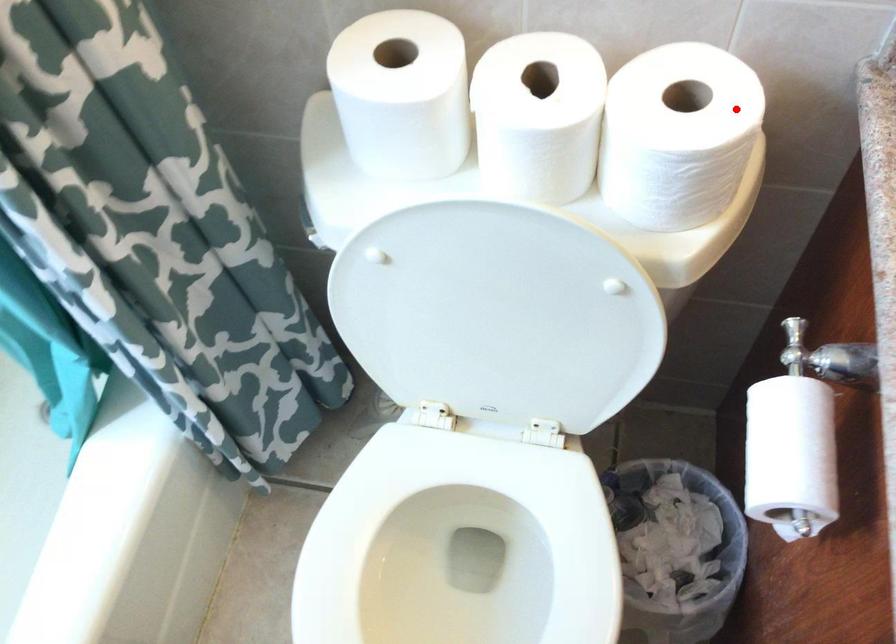
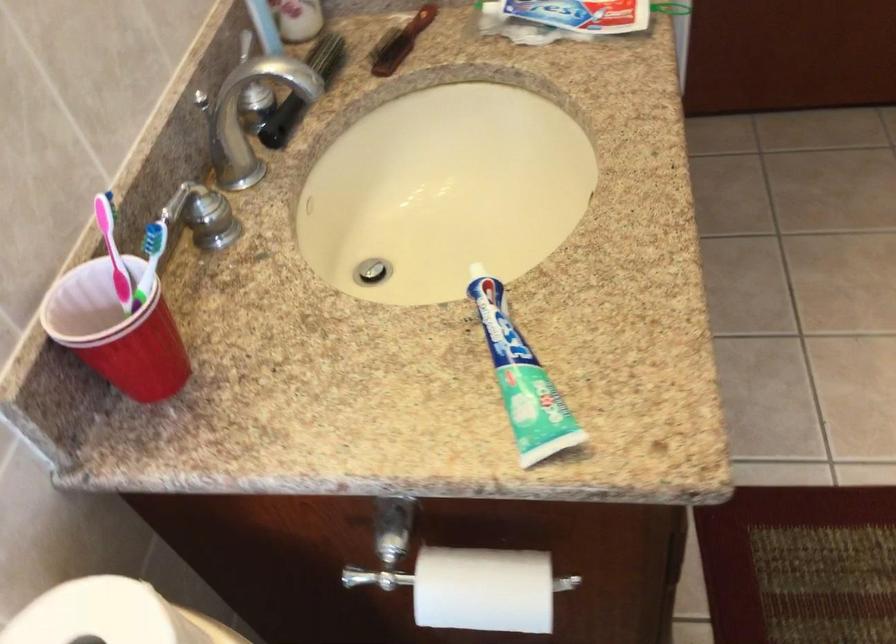
The point at the highlighted location is marked in the first image. Where is the corresponding point in the second image?

(101, 614)